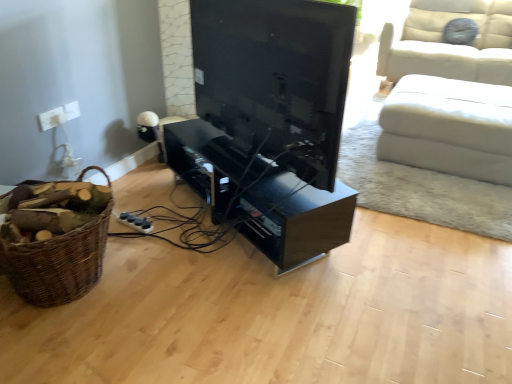
What do you see at coordinates (52, 118) in the screenshot? I see `white plastic socket at upper left` at bounding box center [52, 118].

Where is `white plastic socket at upper left`? The height and width of the screenshot is (384, 512). white plastic socket at upper left is located at coordinates (52, 118).

What do you see at coordinates (58, 264) in the screenshot?
I see `brown woven basket at left` at bounding box center [58, 264].

Identify the location of white plastic socket at upper left. [52, 118].

From the image's perspective, would you say white leather ottoman at right is shown under black glossy entertainment center at center?

No.

Which object is more forward, white leather ottoman at right or black glossy entertainment center at center?

black glossy entertainment center at center is more forward.

Are white leather ottoman at right and black glossy entertainment center at center far apart?

That's right, there is a large distance between white leather ottoman at right and black glossy entertainment center at center.

Between brown woven basket at left and white leather ottoman at right, which one has more height?

brown woven basket at left is taller.

From a real-world perspective, is brown woven basket at left located higher than white leather ottoman at right?

Incorrect, from a real-world perspective, brown woven basket at left is lower than white leather ottoman at right.

Between point (104, 230) and point (475, 135), which one is positioned behind?

Positioned behind is point (475, 135).

Identify the location of basket lying on the left of matte black tv at center. Image resolution: width=512 pixels, height=384 pixels. (58, 264).

Is brown woven basket at left to the left of matte black tv at center from the viewer's perspective?

Correct, you'll find brown woven basket at left to the left of matte black tv at center.

Is brown woven basket at left shorter than matte black tv at center?

Correct, brown woven basket at left is not as tall as matte black tv at center.

Which object is thinner, brown woven basket at left or matte black tv at center?

With smaller width is matte black tv at center.

How many degrees apart are the facing directions of white plastic socket at upper left and white leather ottoman at right?

91.2 degrees separate the facing orientations of white plastic socket at upper left and white leather ottoman at right.

Is white leather ottoman at right located within white plastic socket at upper left?

No, white plastic socket at upper left does not contain white leather ottoman at right.

Does white plastic socket at upper left turn towards white leather ottoman at right?

No.

In the scene shown: Visually, is white plastic socket at upper left positioned to the left or to the right of white leather ottoman at right?

white plastic socket at upper left is to the left of white leather ottoman at right.

Consider the image. Is matte black tv at center facing towards white leather ottoman at right?

Yes, matte black tv at center faces towards white leather ottoman at right.

From a real-world perspective, which object rests below the other?

In real-world perspective, white leather ottoman at right is lower.

Which is in front, point (338, 99) or point (388, 140)?

The point (338, 99) is closer to the camera.

From the image's perspective, is matte black tv at center beneath white leather ottoman at right?

No, from the image's perspective, matte black tv at center is not beneath white leather ottoman at right.

The width and height of the screenshot is (512, 384). What are the coordinates of `electric outlet behind the black glossy entertainment center at center` in the screenshot? It's located at (52, 118).

Does white plastic socket at upper left have a greater height compared to black glossy entertainment center at center?

No.

From the image's perspective, which one is positioned higher, matte black tv at center or white plastic socket at upper left?

matte black tv at center appears higher in the image.

Is matte black tv at center beside white plastic socket at upper left?

matte black tv at center is not next to white plastic socket at upper left, and they're not touching.

Between matte black tv at center and white plastic socket at upper left, which one is positioned behind?

white plastic socket at upper left.

Where is `studio couch that is behind the black glossy entertainment center at center`? studio couch that is behind the black glossy entertainment center at center is located at coordinates (449, 127).

The height and width of the screenshot is (384, 512). In the image, there is a brown woven basket at left. What are the coordinates of `studio couch above it (from the image's perspective)` in the screenshot? It's located at pyautogui.click(x=449, y=127).

Considering their positions, is matte black tv at center positioned further to white leather ottoman at right than black glossy entertainment center at center?

matte black tv at center lies further to white leather ottoman at right than the other object.

Which object lies further to the anchor point black glossy entertainment center at center, brown woven basket at left or white plastic socket at upper left?

white plastic socket at upper left.

Estimate the real-world distances between objects in this image. Which object is closer to matte black tv at center, brown woven basket at left or white plastic socket at upper left?

brown woven basket at left is positioned closer to the anchor matte black tv at center.

From the image, which object appears to be nearer to black glossy entertainment center at center, matte black tv at center or white plastic socket at upper left?

matte black tv at center.

Based on their spatial positions, is black glossy entertainment center at center or white plastic socket at upper left closer to matte black tv at center?

black glossy entertainment center at center lies closer to matte black tv at center than the other object.

When comparing their distances from matte black tv at center, does black glossy entertainment center at center or brown woven basket at left seem closer?

black glossy entertainment center at center.

Based on their spatial positions, is white plastic socket at upper left or black glossy entertainment center at center closer to white leather ottoman at right?

black glossy entertainment center at center is closer to white leather ottoman at right.

Based on their spatial positions, is matte black tv at center or white leather ottoman at right further from white plastic socket at upper left?

The object further to white plastic socket at upper left is white leather ottoman at right.

Where is `entertainment center between brown woven basket at left and white leather ottoman at right`? The width and height of the screenshot is (512, 384). entertainment center between brown woven basket at left and white leather ottoman at right is located at coordinates (260, 195).

Find the location of a particular element. basket between white plastic socket at upper left and matte black tv at center in the horizontal direction is located at coordinates (58, 264).

This screenshot has height=384, width=512. I want to click on television between brown woven basket at left and white leather ottoman at right in the horizontal direction, so click(275, 78).

I want to click on television between white plastic socket at upper left and white leather ottoman at right, so pyautogui.click(x=275, y=78).